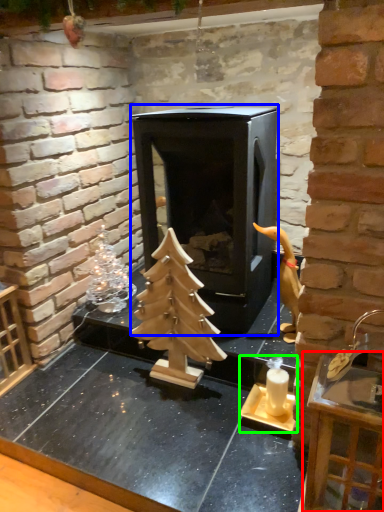
Question: Which object is the closest to the furniture (highlighted by a red box)? Choose among these: fireplace (highlighted by a blue box) or candle holder (highlighted by a green box).

Choices:
 (A) fireplace
 (B) candle holder

Answer: (B)